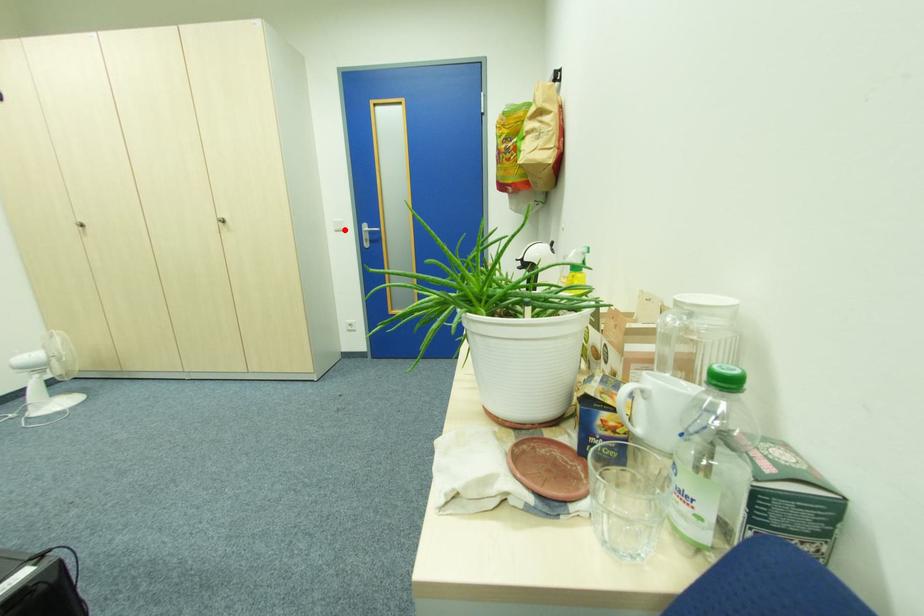
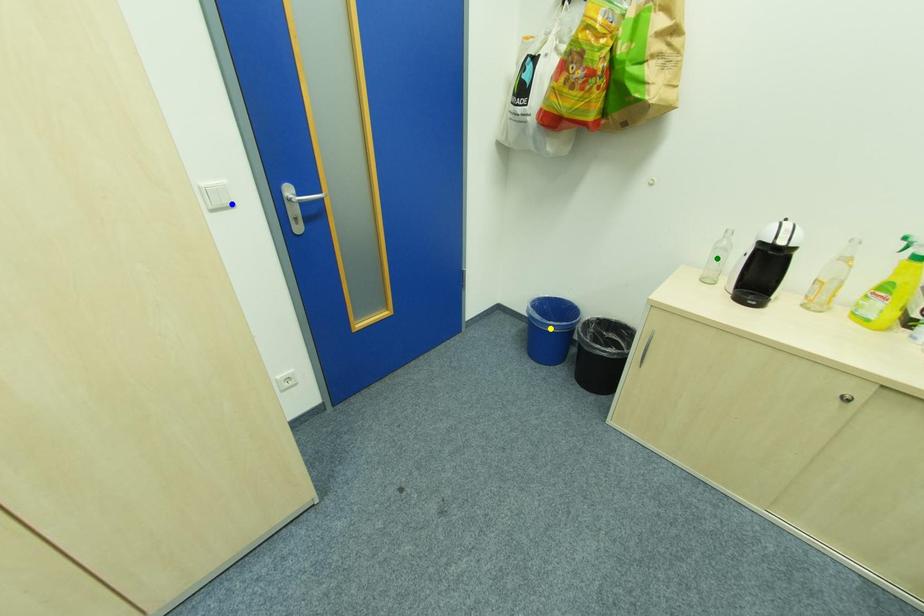
Question: I am providing you with two images of the same scene from different viewpoints. A red point is marked on the first image. You are given multiple points on the second image. Which spot in image 2 lines up with the point in image 1?

Choices:
 (A) green point
 (B) yellow point
 (C) blue point

Answer: (C)